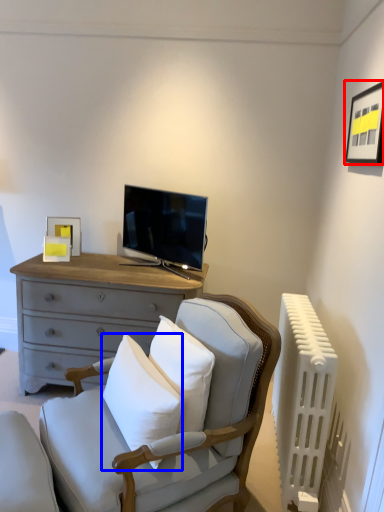
Question: Which point is closer to the camera, picture frame (highlighted by a red box) or pillow (highlighted by a blue box)?

Choices:
 (A) picture frame
 (B) pillow

Answer: (B)